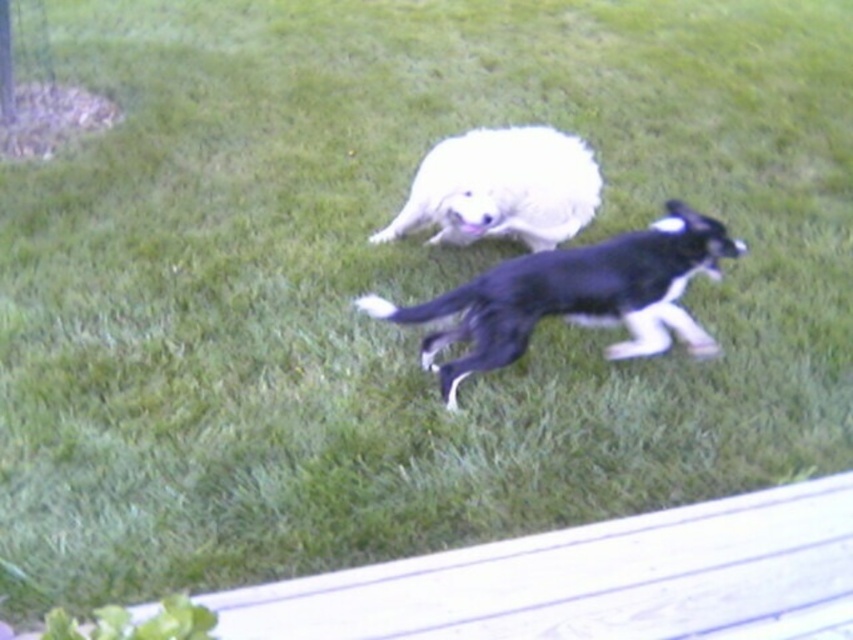
Is point (642, 326) positioned in front of point (498, 212)?

Yes.

Measure the distance from black matte dog at center to white fluffy dog at center.

A distance of 26.74 inches exists between black matte dog at center and white fluffy dog at center.

Is point (426, 317) farther from camera compared to point (508, 218)?

No.

I want to click on black matte dog at center, so click(x=575, y=296).